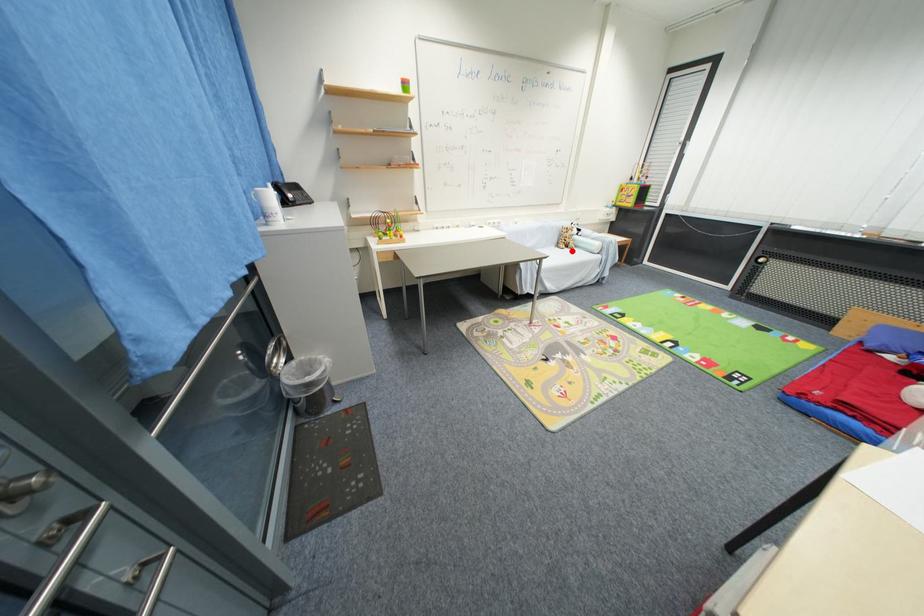
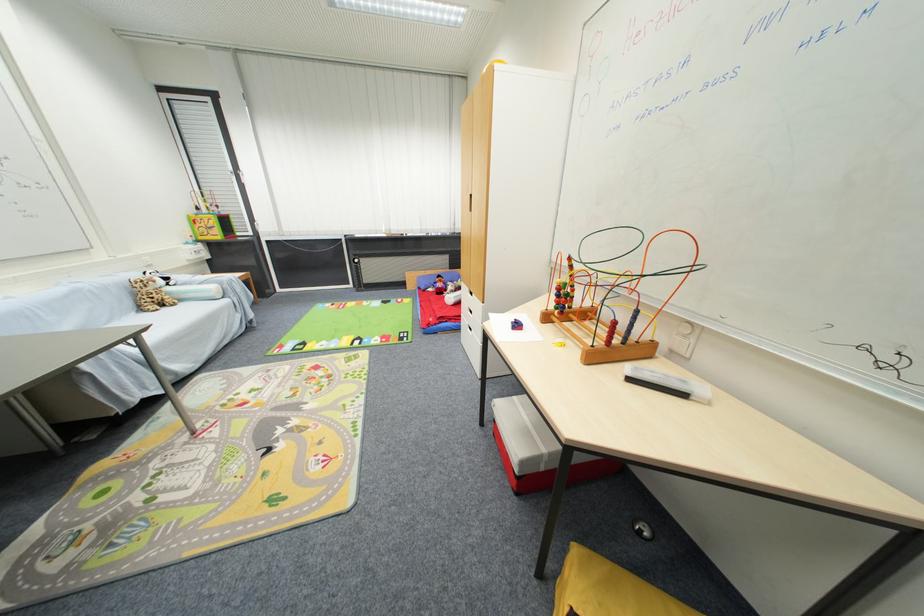
Locate, in the second image, the point that corresponds to the highlighted location in the first image.

(171, 310)